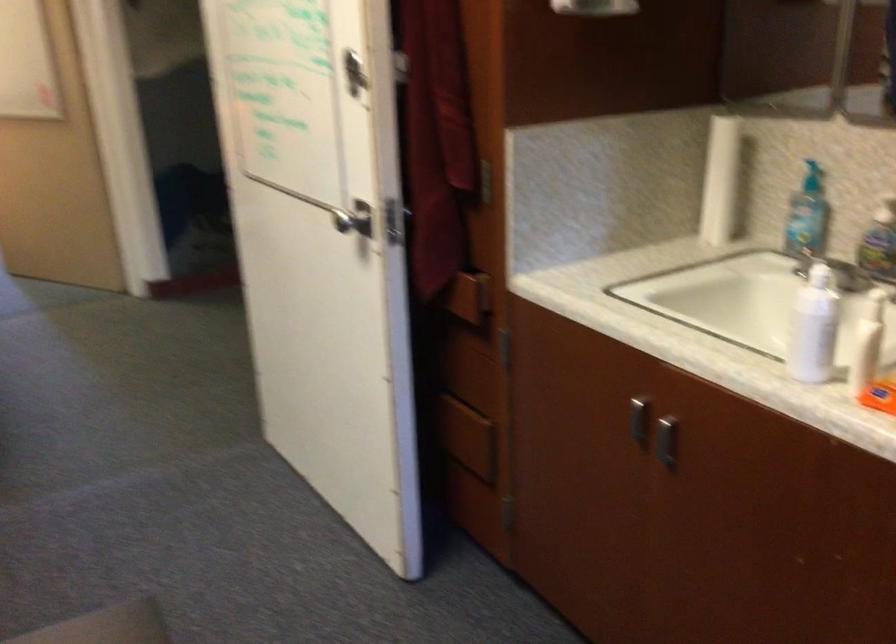
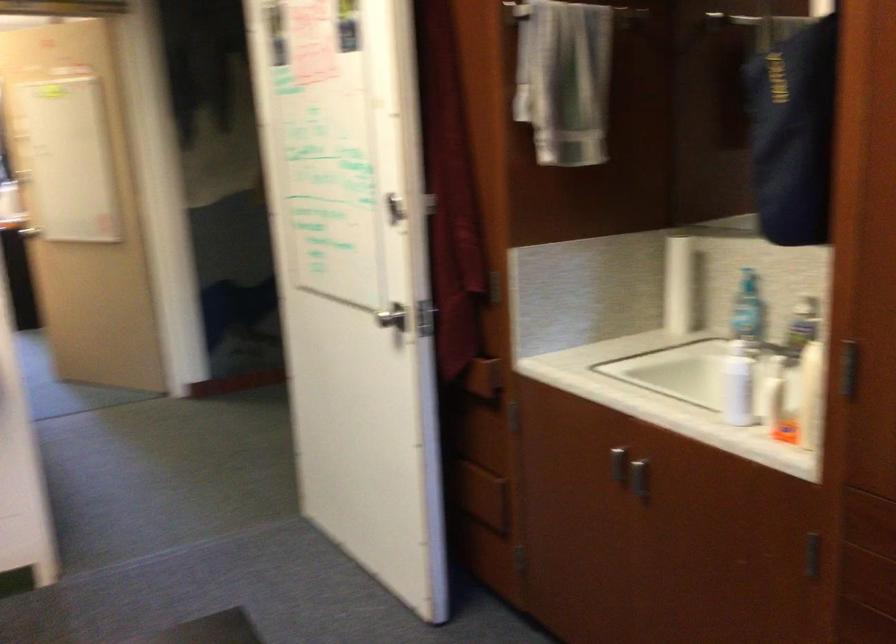
In the second image, find the point that corresponds to the point at 636,417 in the first image.

(618, 464)